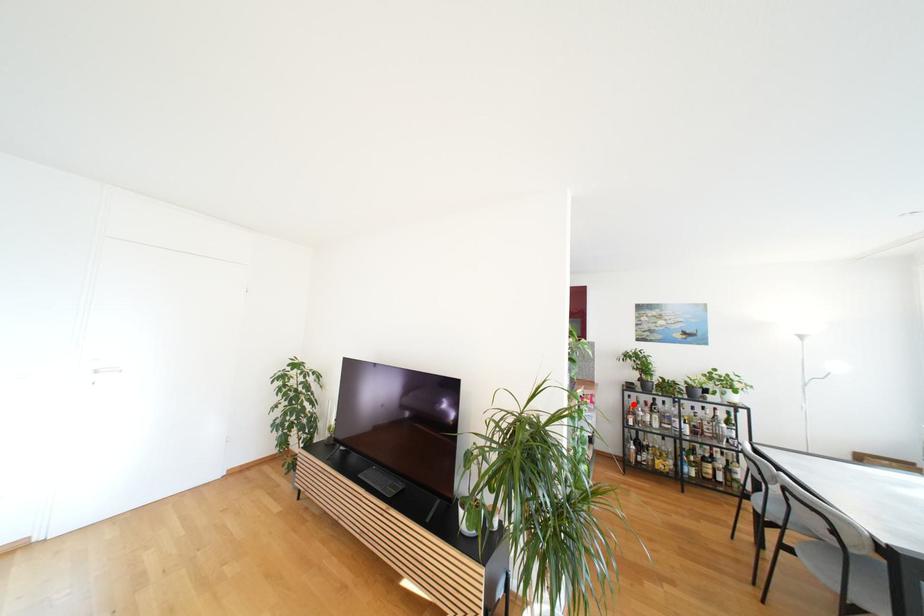
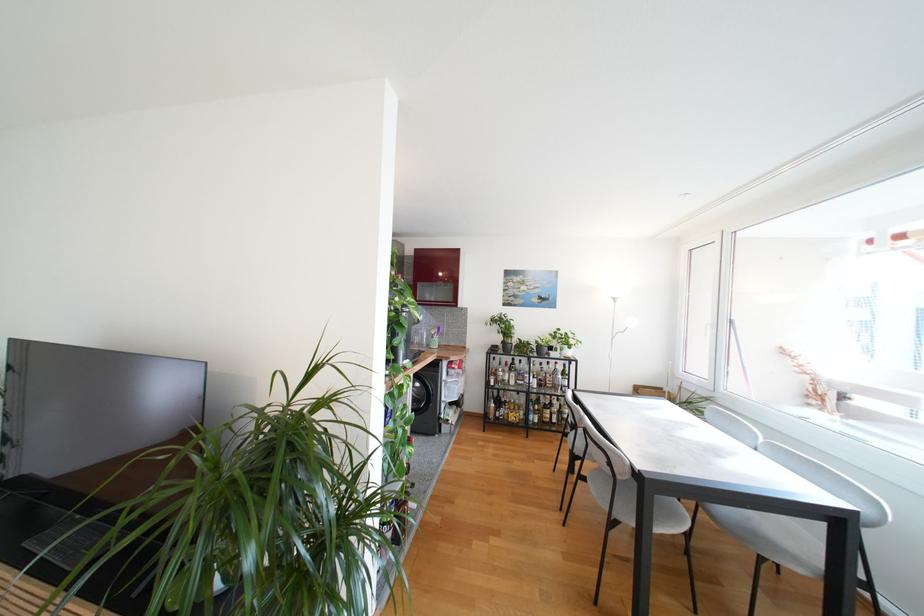
Locate, in the second image, the point that corresponds to the highlighted location in the first image.

(497, 366)